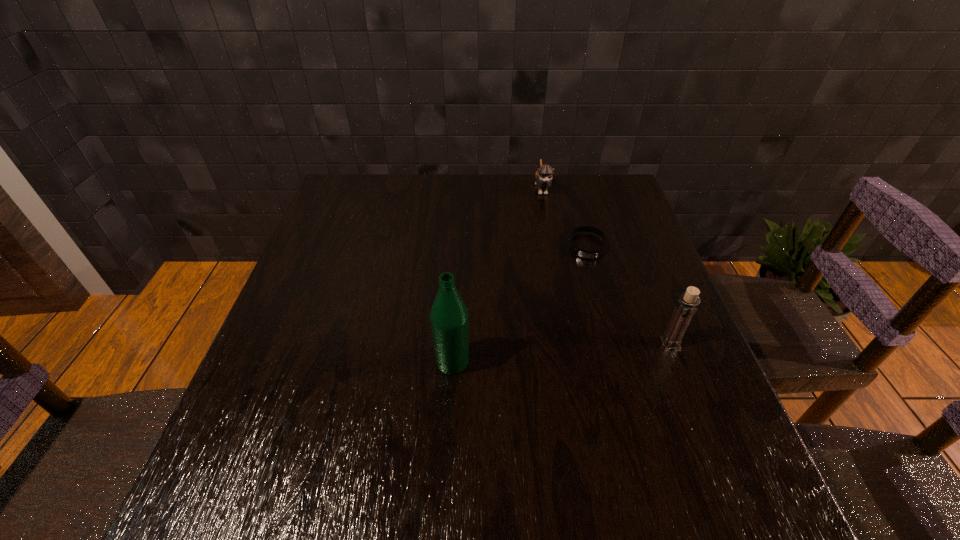
The width and height of the screenshot is (960, 540). I want to click on free space located on the display of the wristband, so click(x=589, y=333).

At what (x,y) coordinates should I click in order to perform the action: click on vacant area situated on the display of the wristband. Please return your answer as a coordinate pair (x, y). This screenshot has height=540, width=960. Looking at the image, I should click on 589,340.

Where is `vacant space situated 0.330m on the display of the wristband`? The height and width of the screenshot is (540, 960). vacant space situated 0.330m on the display of the wristband is located at coordinates (589, 362).

In order to click on vacant region located on the front-facing side of the farthest object in this screenshot , I will do `click(560, 277)`.

Find the location of a particular element. vacant space located 0.380m on the front-facing side of the farthest object is located at coordinates (563, 288).

Where is `free space located on the front-facing side of the farthest object`? This screenshot has width=960, height=540. free space located on the front-facing side of the farthest object is located at coordinates (549, 223).

I want to click on object that is at the far edge, so click(x=543, y=177).

You are a GUI agent. You are given a task and a screenshot of the screen. Output one action in this format:
    pyautogui.click(x=<x>, y=<y>)
    Task: Click on the candle holder that is positioned at the right edge
    This screenshot has width=960, height=540.
    Given the screenshot: What is the action you would take?
    pyautogui.click(x=686, y=306)

You are a GUI agent. You are given a task and a screenshot of the screen. Output one action in this format:
    pyautogui.click(x=<x>, y=<y>)
    Task: Click on the wristband at the right edge
    This screenshot has width=960, height=540.
    Given the screenshot: What is the action you would take?
    pyautogui.click(x=587, y=254)

In the image, there is a desktop. At what (x,y) coordinates should I click in order to perform the action: click on vacant space at the far edge. Please return your answer as a coordinate pair (x, y). Looking at the image, I should click on (564, 184).